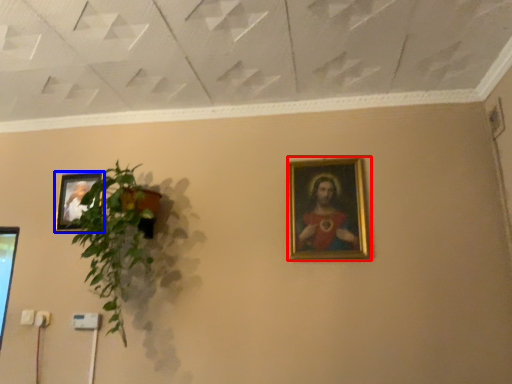
Question: Which object is further to the camera taking this photo, picture frame (highlighted by a red box) or picture frame (highlighted by a blue box)?

Choices:
 (A) picture frame
 (B) picture frame

Answer: (B)